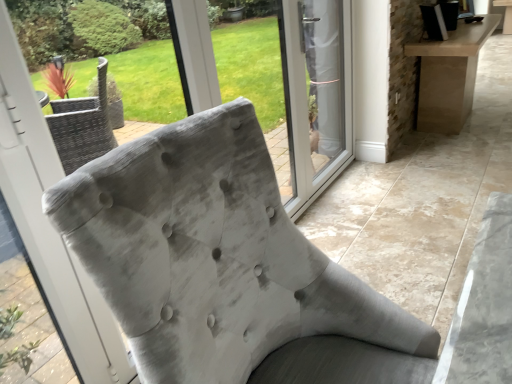
Locate an element on the screen. The width and height of the screenshot is (512, 384). vacant area in front of transparent glass door at center is located at coordinates (341, 208).